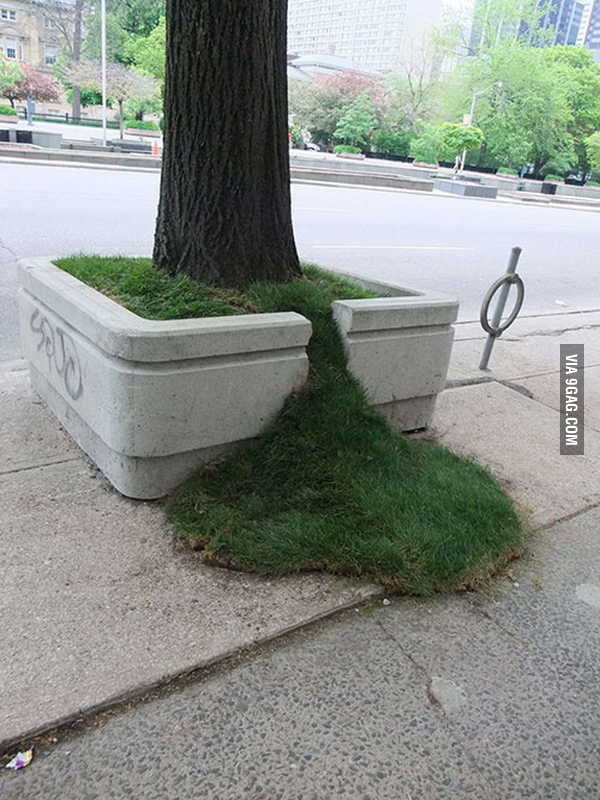
The height and width of the screenshot is (800, 600). I want to click on lamp, so click(476, 102).